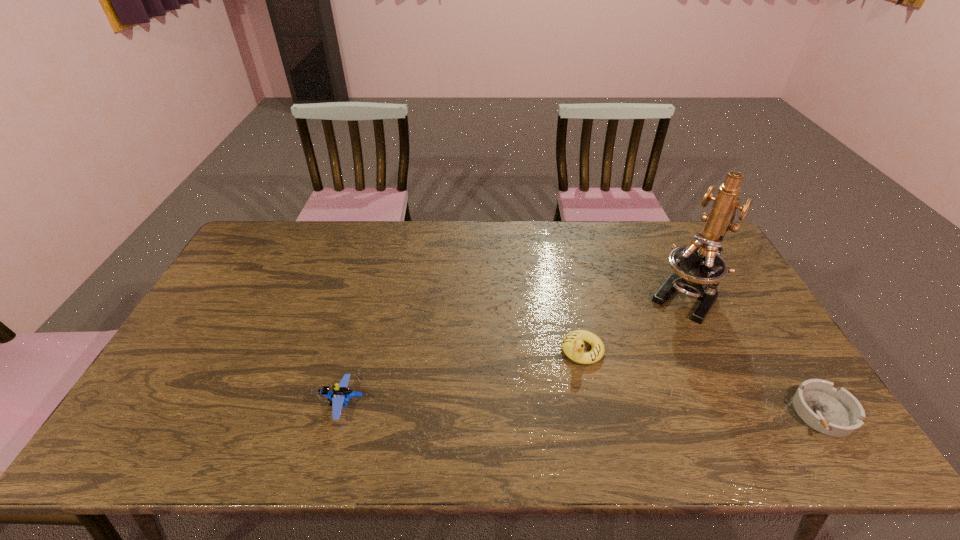
Where is `microscope at the right edge`? The width and height of the screenshot is (960, 540). microscope at the right edge is located at coordinates (698, 268).

I want to click on object at the near right corner, so pyautogui.click(x=837, y=413).

This screenshot has height=540, width=960. In the image, there is a desktop. In order to click on vacant space at the far edge in this screenshot , I will do `click(338, 239)`.

Where is `vacant space at the near edge of the desktop`? vacant space at the near edge of the desktop is located at coordinates click(x=517, y=415).

The image size is (960, 540). In the image, there is a desktop. In order to click on vacant region at the left edge in this screenshot , I will do `click(198, 352)`.

You are a GUI agent. You are given a task and a screenshot of the screen. Output one action in this format:
    pyautogui.click(x=<x>, y=<y>)
    Task: Click on the vacant region at the far left corner
    The image size is (960, 540).
    Given the screenshot: What is the action you would take?
    pyautogui.click(x=281, y=261)

You are a GUI agent. You are given a task and a screenshot of the screen. Output one action in this format:
    pyautogui.click(x=<x>, y=<y>)
    Task: Click on the vacant space at the near left corner of the desktop
    
    Given the screenshot: What is the action you would take?
    pyautogui.click(x=203, y=415)

Where is `empty space between the rightmost object and the leftmost object`? empty space between the rightmost object and the leftmost object is located at coordinates (584, 408).

The width and height of the screenshot is (960, 540). Identify the location of free spot between the tallest object and the second farthest object. (634, 322).

Find the location of a particular element. free space between the rightmost object and the third object from left to right is located at coordinates (755, 354).